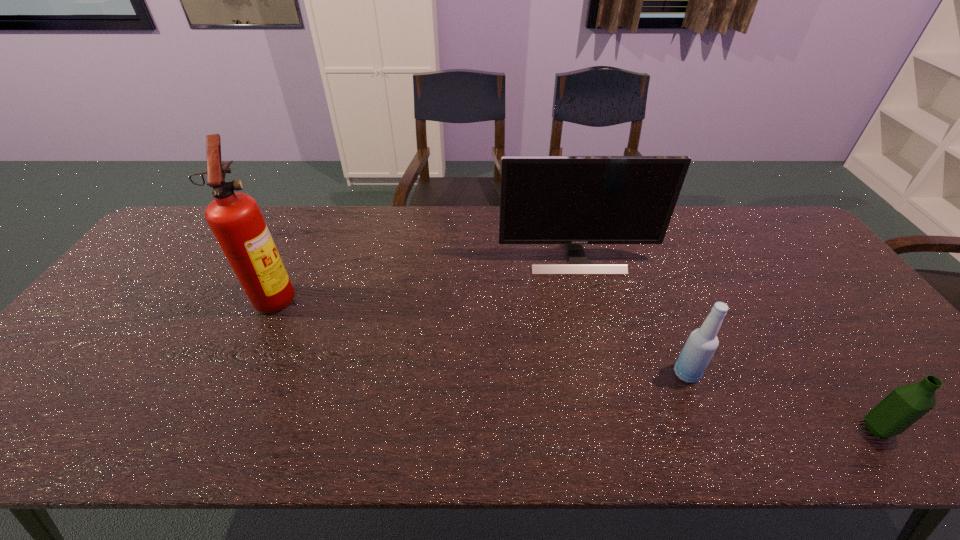
The width and height of the screenshot is (960, 540). Identify the location of vacant area at the near left corner of the desktop. (15, 427).

In the image, there is a desktop. Where is `vacant space at the far right corner`? This screenshot has height=540, width=960. vacant space at the far right corner is located at coordinates (780, 246).

This screenshot has width=960, height=540. What are the coordinates of `free space between the leftmost object and the farthest object` in the screenshot? It's located at (426, 277).

Where is `vacant area that lies between the rightmost object and the third tallest object`? The image size is (960, 540). vacant area that lies between the rightmost object and the third tallest object is located at coordinates 782,401.

Where is `vacant space in between the bottle and the monitor`? vacant space in between the bottle and the monitor is located at coordinates (632, 315).

The width and height of the screenshot is (960, 540). What are the coordinates of `free spot between the third farthest object and the monitor` in the screenshot? It's located at (632, 315).

Locate an element on the screen. This screenshot has height=540, width=960. vacant area that lies between the monitor and the rightmost object is located at coordinates (727, 343).

I want to click on empty space between the second shortest object and the leftmost object, so click(481, 335).

At what (x,y) coordinates should I click in order to perform the action: click on vacant region between the third nearest object and the monitor. Please return your answer as a coordinate pair (x, y). Looking at the image, I should click on tap(426, 277).

Find the location of a particular element. The height and width of the screenshot is (540, 960). unoccupied position between the second shortest object and the second farthest object is located at coordinates (481, 335).